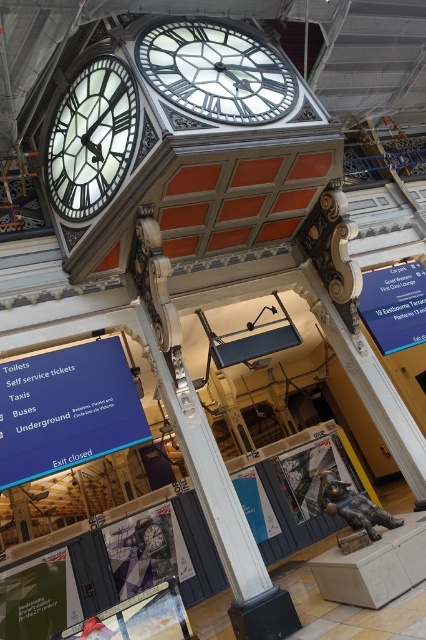
Which of these two, white glossy clock at upper left or green paper at lower left, stands taller?

Standing taller between the two is white glossy clock at upper left.

Can you confirm if white glossy clock at upper left is positioned to the right of green paper at lower left?

Indeed, white glossy clock at upper left is positioned on the right side of green paper at lower left.

What do you see at coordinates (92, 138) in the screenshot?
I see `white glossy clock at upper left` at bounding box center [92, 138].

Locate an element on the screen. The width and height of the screenshot is (426, 640). white glossy clock at upper left is located at coordinates (92, 138).

Does white glossy clock at upper left appear under blue plastic sign at center right?

No.

Does white glossy clock at upper left have a greater width compared to blue plastic sign at center right?

Correct, the width of white glossy clock at upper left exceeds that of blue plastic sign at center right.

Find the location of a particular element. The image size is (426, 640). white glossy clock at upper left is located at coordinates (92, 138).

This screenshot has width=426, height=640. Identify the location of white glossy clock at upper left. (92, 138).

Does white glossy clock at upper left have a smaller size compared to white paper at center?

No.

Who is shorter, white glossy clock at upper left or white paper at center?

Standing shorter between the two is white paper at center.

Is point (120, 156) more distant than point (262, 509)?

No, it is not.

The height and width of the screenshot is (640, 426). I want to click on white glossy clock at upper left, so click(92, 138).